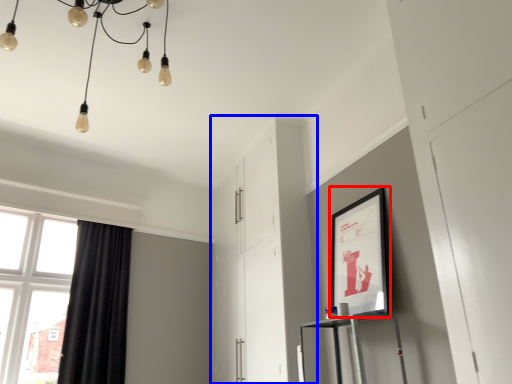
Question: Which of the following is the closest to the observer, picture frame (highlighted by a red box) or dresser (highlighted by a blue box)?

Choices:
 (A) picture frame
 (B) dresser

Answer: (A)